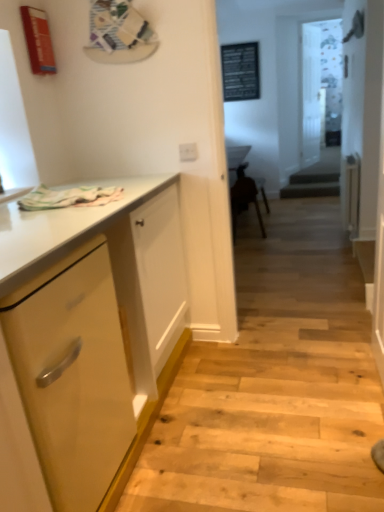
The image size is (384, 512). What do you see at coordinates (188, 152) in the screenshot? I see `white plastic electric outlet at upper center` at bounding box center [188, 152].

This screenshot has height=512, width=384. What do you see at coordinates (240, 71) in the screenshot?
I see `matte black bulletin board at upper center` at bounding box center [240, 71].

You are a GUI agent. You are given a task and a screenshot of the screen. Output one action in this format:
    pyautogui.click(x=<x>, y=<y>)
    Task: Click on the transparent glass door at center, which appears as the 2th glass door when viewed from the back
    This screenshot has height=512, width=384.
    Given the screenshot: What is the action you would take?
    (321, 86)

Describe the element at coordinates (311, 94) in the screenshot. I see `transparent glass door at center, which appears as the 2th glass door when viewed from the front` at that location.

This screenshot has width=384, height=512. I want to click on transparent glass door at center, which appears as the 2th glass door when viewed from the front, so click(311, 94).

The width and height of the screenshot is (384, 512). I want to click on white plastic electric outlet at upper center, so pyautogui.click(x=188, y=152).

Which is behind, point (221, 57) or point (234, 194)?

The point (221, 57) is more distant.

From a real-world perspective, is matte black bulletin board at upper center below brown wooden chair at center?

No, from a real-world perspective, matte black bulletin board at upper center is not beneath brown wooden chair at center.

In the scene shown: From the image's perspective, which is above, matte black bulletin board at upper center or brown wooden chair at center?

matte black bulletin board at upper center.

Based on the photo, considering the sizes of matte black bulletin board at upper center and brown wooden chair at center in the image, is matte black bulletin board at upper center wider or thinner than brown wooden chair at center?

Considering their sizes, matte black bulletin board at upper center looks slimmer than brown wooden chair at center.

The image size is (384, 512). There is a matte yellow cabinet at left. In order to click on the 1st glass door above it (from the image's perspective) in this screenshot , I will do `click(321, 86)`.

From the image's perspective, between matte yellow cabinet at left and transparent glass door at center, which appears as the 2th glass door when viewed from the back, which one is located above?

transparent glass door at center, which appears as the 2th glass door when viewed from the back, from the image's perspective.

Are matte yellow cabinet at left and transparent glass door at center, the 1th glass door in the front-to-back sequence, making contact?

No, matte yellow cabinet at left is not making contact with transparent glass door at center, the 1th glass door in the front-to-back sequence.

Would you say transparent glass door at center, which is the first glass door in back-to-front order, is inside or outside transparent glass door at center, the 1th glass door in the front-to-back sequence?

The correct answer is: outside.

Between transparent glass door at center, which is the first glass door in back-to-front order, and transparent glass door at center, which appears as the 2th glass door when viewed from the back, which one has more height?

transparent glass door at center, which is the first glass door in back-to-front order, is taller.

Considering the sizes of objects transparent glass door at center, which appears as the 2th glass door when viewed from the front, and transparent glass door at center, the 1th glass door in the front-to-back sequence, in the image provided, who is wider, transparent glass door at center, which appears as the 2th glass door when viewed from the front, or transparent glass door at center, the 1th glass door in the front-to-back sequence,?

Wider between the two is transparent glass door at center, the 1th glass door in the front-to-back sequence.

From the image's perspective, is transparent glass door at center, which is the first glass door in back-to-front order, beneath transparent glass door at center, the 1th glass door in the front-to-back sequence?

No, from the image's perspective, transparent glass door at center, which is the first glass door in back-to-front order, is not beneath transparent glass door at center, the 1th glass door in the front-to-back sequence.

Does matte yellow cabinet at left have a lesser width compared to transparent glass door at center, which is the first glass door in back-to-front order?

No.

Considering the sizes of objects matte yellow cabinet at left and transparent glass door at center, which is the first glass door in back-to-front order, in the image provided, who is taller, matte yellow cabinet at left or transparent glass door at center, which is the first glass door in back-to-front order,?

transparent glass door at center, which is the first glass door in back-to-front order, is taller.

From the image's perspective, relative to transparent glass door at center, which appears as the 2th glass door when viewed from the front, is matte yellow cabinet at left above or below?

matte yellow cabinet at left is situated lower than transparent glass door at center, which appears as the 2th glass door when viewed from the front, in the image.

This screenshot has width=384, height=512. There is a white plastic electric outlet at upper center. What are the coordinates of `the 1st glass door above it (from a real-world perspective)` in the screenshot? It's located at (321, 86).

Which of these two, white plastic electric outlet at upper center or transparent glass door at center, which appears as the 2th glass door when viewed from the back, is thinner?

white plastic electric outlet at upper center is thinner.

From the image's perspective, is white plastic electric outlet at upper center located above or below transparent glass door at center, the 1th glass door in the front-to-back sequence?

Clearly, from the image's perspective, white plastic electric outlet at upper center is below transparent glass door at center, the 1th glass door in the front-to-back sequence.

Which of these two, white plastic electric outlet at upper center or transparent glass door at center, the 1th glass door in the front-to-back sequence, stands taller?

transparent glass door at center, the 1th glass door in the front-to-back sequence.

Could you measure the distance between transparent glass door at center, the 1th glass door in the front-to-back sequence, and white plastic electric outlet at upper center?

transparent glass door at center, the 1th glass door in the front-to-back sequence, and white plastic electric outlet at upper center are 4.75 meters apart from each other.

Which of these two, transparent glass door at center, which appears as the 2th glass door when viewed from the back, or white plastic electric outlet at upper center, is thinner?

white plastic electric outlet at upper center is thinner.

From the image's perspective, is transparent glass door at center, which appears as the 2th glass door when viewed from the back, over white plastic electric outlet at upper center?

Correct, transparent glass door at center, which appears as the 2th glass door when viewed from the back, appears higher than white plastic electric outlet at upper center in the image.

Looking at this image, choose the correct answer: Is transparent glass door at center, which appears as the 2th glass door when viewed from the back, inside white plastic electric outlet at upper center or outside it?

transparent glass door at center, which appears as the 2th glass door when viewed from the back, exists outside the volume of white plastic electric outlet at upper center.

Is white plastic electric outlet at upper center not close to transparent glass door at center, which is the first glass door in back-to-front order?

Yes, white plastic electric outlet at upper center and transparent glass door at center, which is the first glass door in back-to-front order, are located far from each other.

Measure the distance from white plastic electric outlet at upper center to transparent glass door at center, which is the first glass door in back-to-front order.

white plastic electric outlet at upper center is 4.62 meters from transparent glass door at center, which is the first glass door in back-to-front order.

Find the location of `electric outlet below the transparent glass door at center, which appears as the 2th glass door when viewed from the front (from the image's perspective)`. electric outlet below the transparent glass door at center, which appears as the 2th glass door when viewed from the front (from the image's perspective) is located at coordinates (188, 152).

Considering the points (179, 149) and (307, 151), which point is in front, point (179, 149) or point (307, 151)?

The point (179, 149) is closer.

Where is `chair below the matte black bulletin board at upper center (from the image's perspective)`? chair below the matte black bulletin board at upper center (from the image's perspective) is located at coordinates (244, 198).

At what (x,y) coordinates should I click in order to perform the action: click on cabinetry on the left of transparent glass door at center, the 1th glass door in the front-to-back sequence. Please return your answer as a coordinate pair (x, y). This screenshot has height=512, width=384. Looking at the image, I should click on (92, 327).

Which object lies further to the anchor point transparent glass door at center, the 1th glass door in the front-to-back sequence, matte black bulletin board at upper center or brown wooden chair at center?

brown wooden chair at center is further to transparent glass door at center, the 1th glass door in the front-to-back sequence.

When comparing their distances from matte yellow cabinet at left, does transparent glass door at center, which appears as the 2th glass door when viewed from the back, or matte black bulletin board at upper center seem further?

transparent glass door at center, which appears as the 2th glass door when viewed from the back, is positioned further to the anchor matte yellow cabinet at left.

Considering their positions, is white plastic electric outlet at upper center positioned further to transparent glass door at center, which appears as the 2th glass door when viewed from the back, than transparent glass door at center, which is the first glass door in back-to-front order?

Based on the image, white plastic electric outlet at upper center appears to be further to transparent glass door at center, which appears as the 2th glass door when viewed from the back.

Which object lies nearer to the anchor point transparent glass door at center, which is the first glass door in back-to-front order, matte black bulletin board at upper center or transparent glass door at center, the 1th glass door in the front-to-back sequence?

transparent glass door at center, the 1th glass door in the front-to-back sequence, is closer to transparent glass door at center, which is the first glass door in back-to-front order.

From the image, which object appears to be farther from matte black bulletin board at upper center, transparent glass door at center, the 1th glass door in the front-to-back sequence, or white plastic electric outlet at upper center?

Based on the image, white plastic electric outlet at upper center appears to be further to matte black bulletin board at upper center.

Considering their positions, is white plastic electric outlet at upper center positioned further to matte black bulletin board at upper center than transparent glass door at center, which appears as the 2th glass door when viewed from the back?

The object further to matte black bulletin board at upper center is white plastic electric outlet at upper center.

From the picture: Based on their spatial positions, is transparent glass door at center, which is the first glass door in back-to-front order, or transparent glass door at center, the 1th glass door in the front-to-back sequence, further from brown wooden chair at center?

Among the two, transparent glass door at center, the 1th glass door in the front-to-back sequence, is located further to brown wooden chair at center.

From the image, which object appears to be farther from white plastic electric outlet at upper center, transparent glass door at center, which is the first glass door in back-to-front order, or matte yellow cabinet at left?

The object further to white plastic electric outlet at upper center is transparent glass door at center, which is the first glass door in back-to-front order.

Identify the location of bulletin board between white plastic electric outlet at upper center and transparent glass door at center, the 1th glass door in the front-to-back sequence, along the z-axis. This screenshot has width=384, height=512. (240, 71).

Where is `electric outlet between matte yellow cabinet at left and brown wooden chair at center along the z-axis`? The image size is (384, 512). electric outlet between matte yellow cabinet at left and brown wooden chair at center along the z-axis is located at coordinates (188, 152).

Find the location of a particular element. Image resolution: width=384 pixels, height=512 pixels. chair positioned between matte yellow cabinet at left and matte black bulletin board at upper center from near to far is located at coordinates (244, 198).

The image size is (384, 512). Find the location of `electric outlet between matte yellow cabinet at left and transparent glass door at center, which appears as the 2th glass door when viewed from the front, from front to back`. electric outlet between matte yellow cabinet at left and transparent glass door at center, which appears as the 2th glass door when viewed from the front, from front to back is located at coordinates (188, 152).